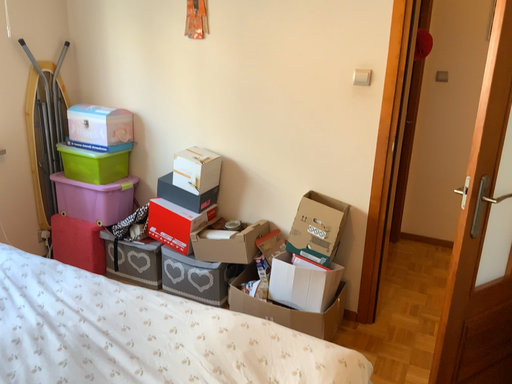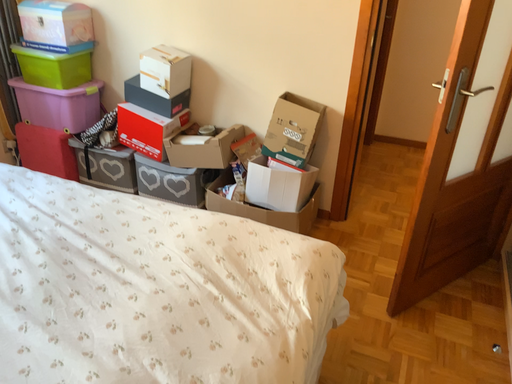
Question: How did the camera likely rotate when shooting the video?

Choices:
 (A) rotated downward
 (B) rotated upward

Answer: (A)